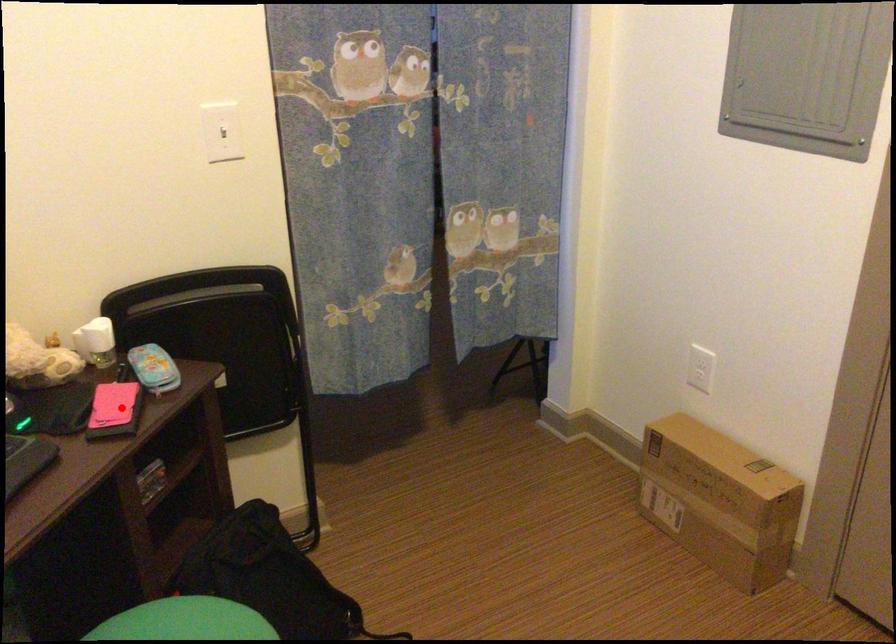
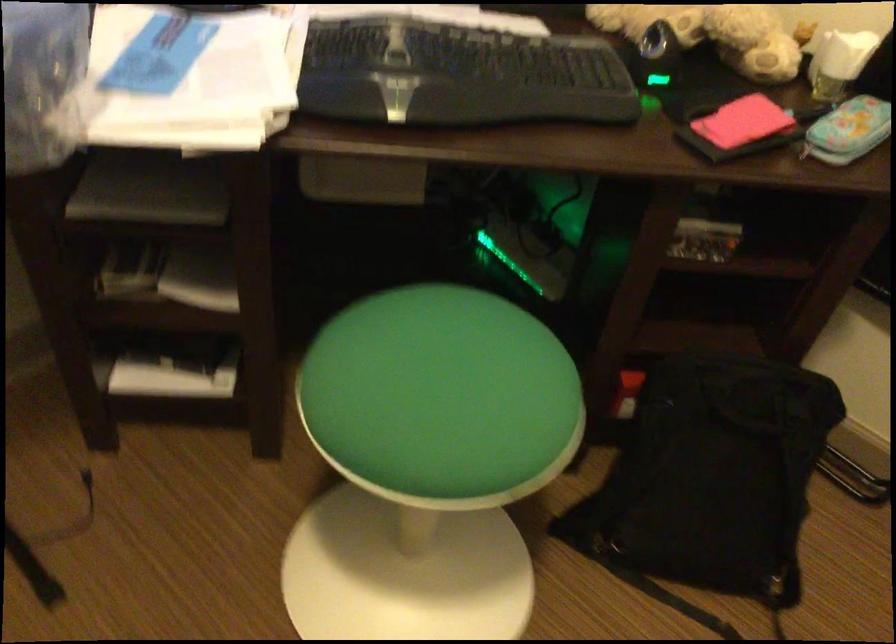
Find the pixel in the second image that matches the highlighted location in the first image.

(739, 128)